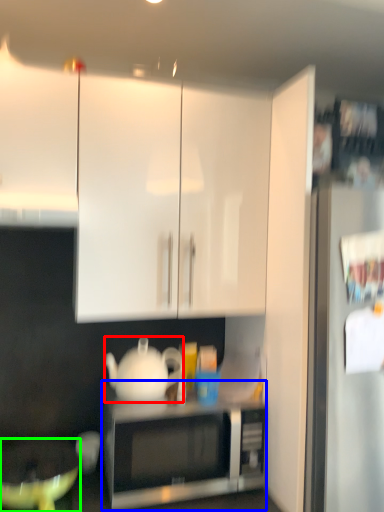
Question: Which object is the closest to the teapot (highlighted by a red box)? Choose among these: microwave oven (highlighted by a blue box) or mixing bowl (highlighted by a green box).

Choices:
 (A) microwave oven
 (B) mixing bowl

Answer: (A)